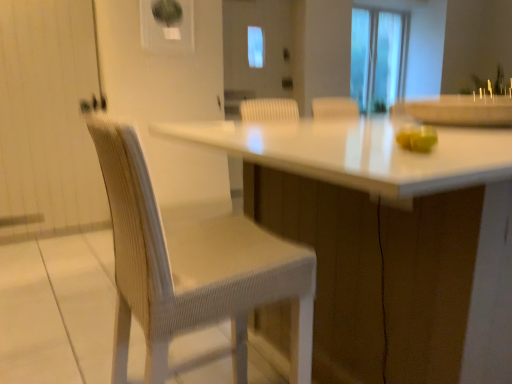
What do you see at coordinates (257, 52) in the screenshot? I see `transparent glass screen door at center` at bounding box center [257, 52].

In order to click on transparent glass screen door at center in this screenshot , I will do [x=257, y=52].

This screenshot has width=512, height=384. I want to click on screen door that appears behind the white glossy table at center, so click(257, 52).

Considering the points (234, 0) and (469, 130), which point is behind, point (234, 0) or point (469, 130)?

The point (234, 0) is more distant.

Consider the image. Considering the relative sizes of transparent glass screen door at center and white glossy table at center in the image provided, is transparent glass screen door at center taller than white glossy table at center?

Yes.

Does transparent glass screen door at center turn towards green matte apple at right?

No.

From the image's perspective, is transparent glass screen door at center above or below green matte apple at right?

transparent glass screen door at center is situated higher than green matte apple at right in the image.

Is transparent glass screen door at center further to camera compared to green matte apple at right?

Yes.

Looking at this image, between white glossy table at center and transparent glass screen door at center, which one has larger width?

Wider between the two is white glossy table at center.

Is transparent glass screen door at center at the back of white glossy table at center?

No, transparent glass screen door at center is not at the back of white glossy table at center.

From the picture: Are white glossy table at center and transparent glass screen door at center far apart?

Absolutely, white glossy table at center is distant from transparent glass screen door at center.

Which is behind, point (366, 370) or point (284, 53)?

Positioned behind is point (284, 53).

From the image's perspective, is green matte apple at right located above or below transparent glass screen door at center?

Based on their image positions, green matte apple at right is located beneath transparent glass screen door at center.

Who is bigger, green matte apple at right or transparent glass screen door at center?

With larger size is transparent glass screen door at center.

Is green matte apple at right not inside transparent glass screen door at center?

Yes.

Looking at this image, considering the sizes of objects green matte apple at right and transparent glass screen door at center in the image provided, who is taller, green matte apple at right or transparent glass screen door at center?

transparent glass screen door at center.

Find the location of `food on the left of the white glossy table at center`. food on the left of the white glossy table at center is located at coordinates (416, 138).

Is white glossy table at center to the left of green matte apple at right from the viewer's perspective?

No, white glossy table at center is not to the left of green matte apple at right.

Considering the sizes of white glossy table at center and green matte apple at right in the image, is white glossy table at center wider or thinner than green matte apple at right?

Clearly, white glossy table at center has more width compared to green matte apple at right.

Considering the positions of objects white glossy table at center and green matte apple at right in the image provided, who is behind, white glossy table at center or green matte apple at right?

green matte apple at right is more distant.

Which is in front, point (421, 150) or point (351, 363)?

The point (421, 150) is more forward.

Does green matte apple at right come behind white glossy table at center?

Yes, it is behind white glossy table at center.

Is green matte apple at right facing towards white glossy table at center?

No, green matte apple at right is not aimed at white glossy table at center.

Considering the relative sizes of green matte apple at right and white glossy table at center in the image provided, is green matte apple at right shorter than white glossy table at center?

Yes.

At what (x,y) coordinates should I click in order to perform the action: click on table that is below the transparent glass screen door at center (from the image's perspective). Please return your answer as a coordinate pair (x, y). Looking at the image, I should click on (388, 240).

Where is `screen door above the green matte apple at right (from a real-world perspective)`? screen door above the green matte apple at right (from a real-world perspective) is located at coordinates (257, 52).

Considering their positions, is green matte apple at right positioned further to transparent glass screen door at center than white glossy table at center?

Based on the image, green matte apple at right appears to be further to transparent glass screen door at center.

Which object lies further to the anchor point white glossy table at center, green matte apple at right or transparent glass screen door at center?

The object further to white glossy table at center is transparent glass screen door at center.

From the picture: Considering their positions, is white glossy table at center positioned further to transparent glass screen door at center than green matte apple at right?

green matte apple at right is positioned further to the anchor transparent glass screen door at center.

Which object lies further to the anchor point green matte apple at right, white glossy table at center or transparent glass screen door at center?

transparent glass screen door at center lies further to green matte apple at right than the other object.

Estimate the real-world distances between objects in this image. Which object is further from white glossy table at center, transparent glass screen door at center or green matte apple at right?

Among the two, transparent glass screen door at center is located further to white glossy table at center.

Which object lies further to the anchor point green matte apple at right, transparent glass screen door at center or white glossy table at center?

Based on the image, transparent glass screen door at center appears to be further to green matte apple at right.

The height and width of the screenshot is (384, 512). What are the coordinates of `food positioned between white glossy table at center and transparent glass screen door at center from near to far` in the screenshot? It's located at (416, 138).